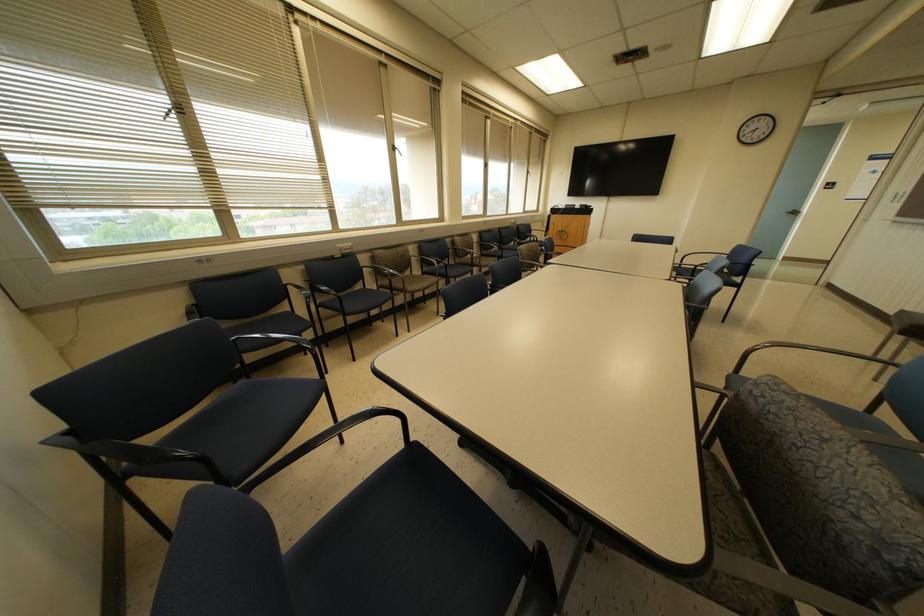
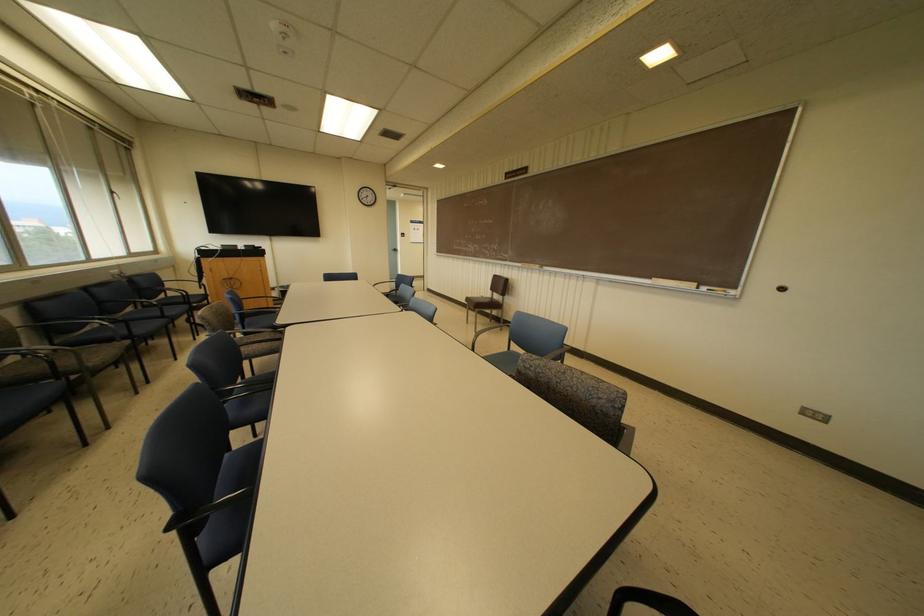
Question: Based on the continuous images, in which direction is the camera rotating? Reply with the corresponding letter.

Choices:
 (A) Left
 (B) Right
 (C) Up
 (D) Down

Answer: (B)